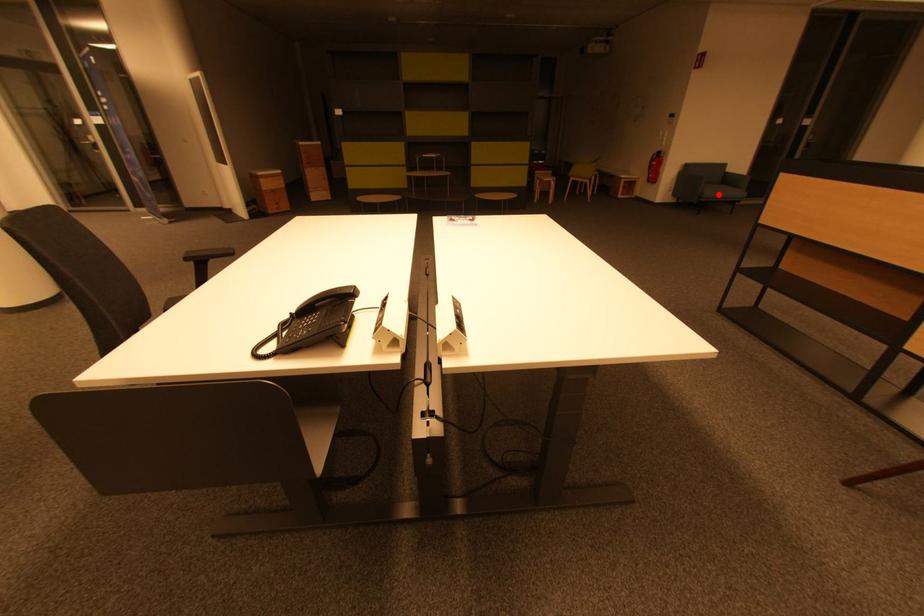
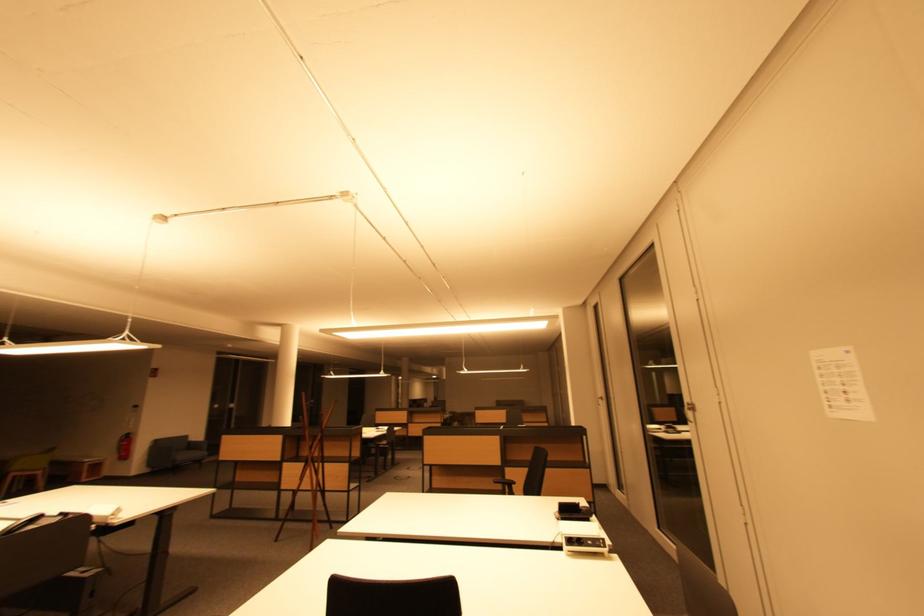
Question: I am providing you with two images of the same scene from different viewpoints. Given a red point in image1, look at the same physical point in image2. Is it:

Choices:
 (A) Closer to the viewpoint
 (B) Farther from the viewpoint

Answer: (B)